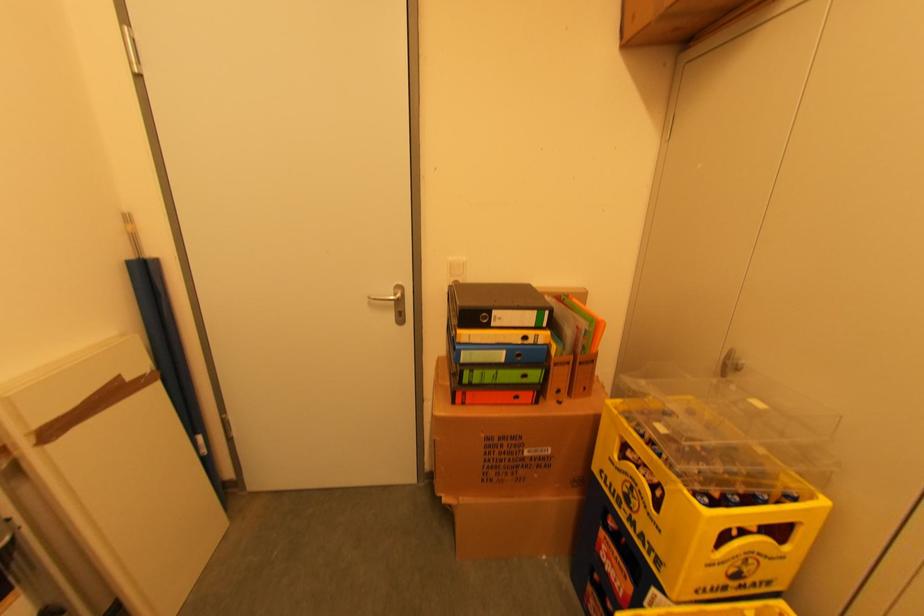
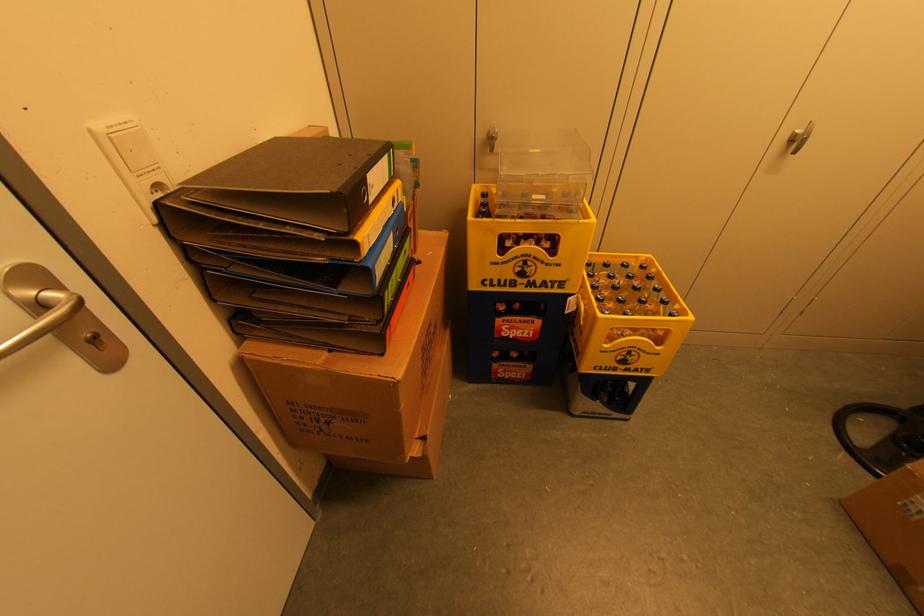
The point at (x=497, y=315) is marked in the first image. Where is the corresponding point in the second image?

(371, 185)